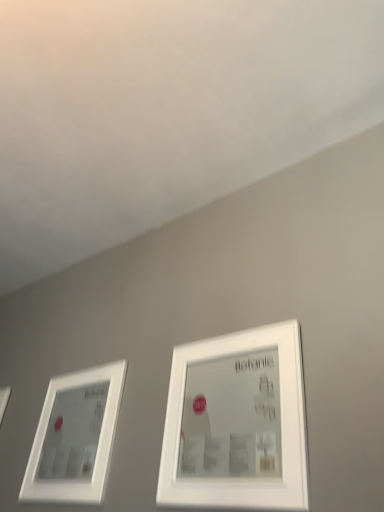
Question: From the image's perspective, is white matte picture frame at center, positioned as the first picture frame in right-to-left order, above or below white matte picture frame at left, which ranks as the 1th picture frame in left-to-right order?

Choices:
 (A) above
 (B) below

Answer: (A)

Question: Which is correct: white matte picture frame at center, positioned as the first picture frame in right-to-left order, is inside white matte picture frame at left, which ranks as the 1th picture frame in left-to-right order, or outside of it?

Choices:
 (A) outside
 (B) inside

Answer: (A)

Question: Would you say white matte picture frame at center, positioned as the first picture frame in right-to-left order, is to the left or to the right of white matte picture frame at left, which ranks as the 1th picture frame in left-to-right order, in the picture?

Choices:
 (A) left
 (B) right

Answer: (B)

Question: Relative to white matte picture frame at center, the 2th picture frame positioned from the left, is white matte picture frame at left, the second picture frame viewed from the right, in front or behind?

Choices:
 (A) behind
 (B) front

Answer: (A)

Question: Which is correct: white matte picture frame at left, the second picture frame viewed from the right, is inside white matte picture frame at center, positioned as the first picture frame in right-to-left order, or outside of it?

Choices:
 (A) inside
 (B) outside

Answer: (B)

Question: In terms of size, does white matte picture frame at left, which ranks as the 1th picture frame in left-to-right order, appear bigger or smaller than white matte picture frame at center, positioned as the first picture frame in right-to-left order?

Choices:
 (A) big
 (B) small

Answer: (A)

Question: From a real-world perspective, is white matte picture frame at left, which ranks as the 1th picture frame in left-to-right order, physically located above or below white matte picture frame at center, the 2th picture frame positioned from the left?

Choices:
 (A) above
 (B) below

Answer: (A)